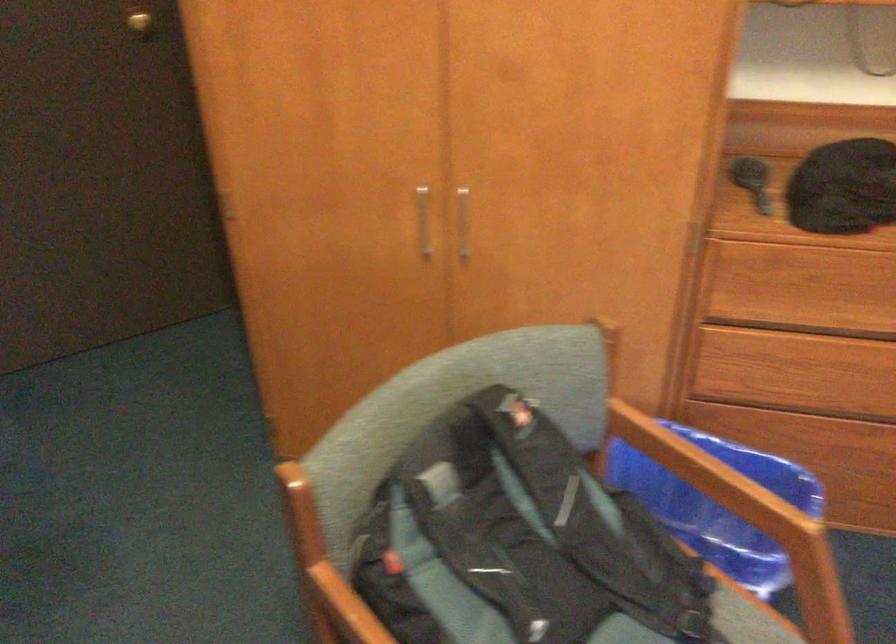
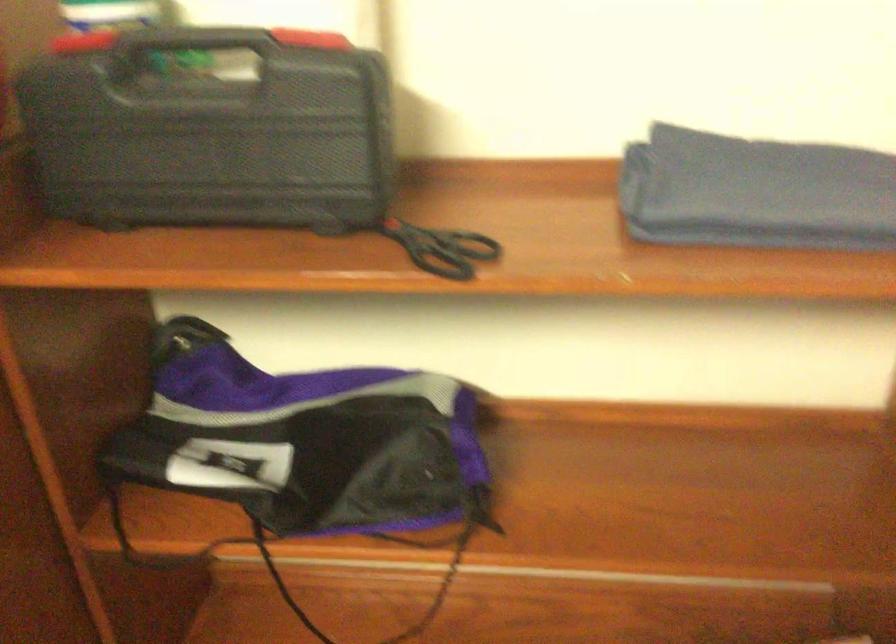
Looking at this image, the images are taken continuously from a first-person perspective. In which direction are you moving?

The cameraman walked toward right, forward.